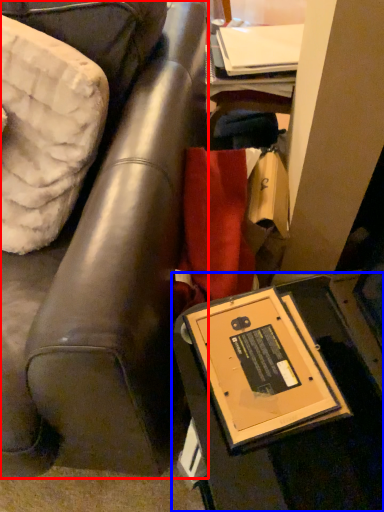
Question: Which object is further to the camera taking this photo, furniture (highlighted by a red box) or table (highlighted by a blue box)?

Choices:
 (A) furniture
 (B) table

Answer: (B)